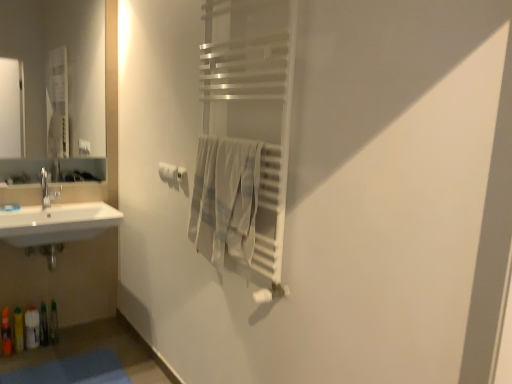
The width and height of the screenshot is (512, 384). I want to click on vacant space in front of translucent plastic bottles at lower left, which ranks as the third toiletry in left-to-right order, so click(x=26, y=358).